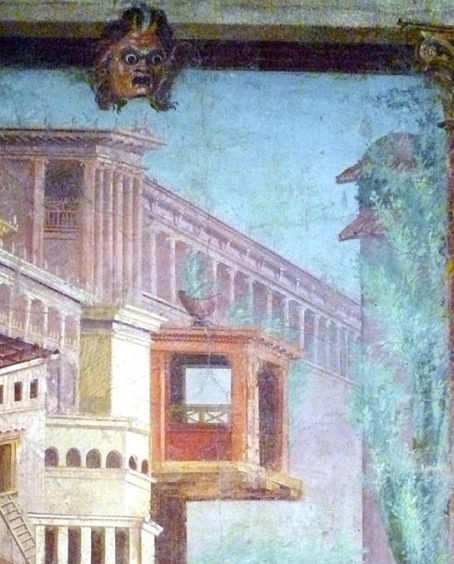
Locate an element on the screen. Image resolution: width=454 pixels, height=564 pixels. tall plant is located at coordinates (379, 202), (405, 280), (372, 283), (366, 389), (396, 515), (432, 453), (424, 332), (438, 252), (426, 202), (431, 138).